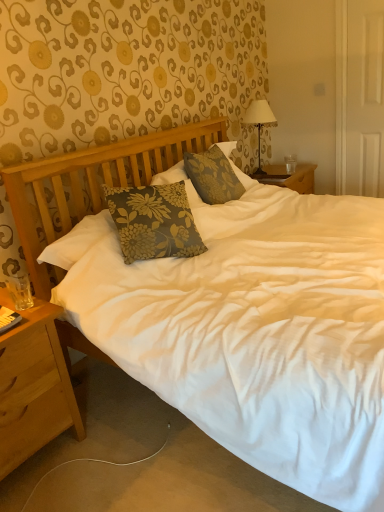
Describe the element at coordinates (34, 388) in the screenshot. This screenshot has height=512, width=384. I see `light brown wood nightstand at lower left` at that location.

Identify the location of light brown wood nightstand at lower left. (34, 388).

This screenshot has height=512, width=384. What do you see at coordinates (259, 124) in the screenshot?
I see `white fabric-covered lamp at upper right` at bounding box center [259, 124].

Find the location of a particular element. This screenshot has width=384, height=512. clear glass coffee cup at right is located at coordinates (290, 163).

Find the location of a particular element. This screenshot has height=512, width=384. floral fabric pillow at center is located at coordinates (171, 175).

Is point (227, 145) less distant than point (292, 156)?

Yes, it is in front of point (292, 156).

From a real-world perspective, relative to clear glass coffee cup at right, is floral fabric pillow at center vertically above or below?

Clearly, from a real-world perspective, floral fabric pillow at center is above clear glass coffee cup at right.

Is floral fabric pillow at center further to camera compared to clear glass coffee cup at right?

No, floral fabric pillow at center is in front of clear glass coffee cup at right.

Does floral fabric pillow at center have a larger size compared to clear glass coffee cup at right?

Indeed, floral fabric pillow at center has a larger size compared to clear glass coffee cup at right.

Locate an element on the screen. This screenshot has height=512, width=384. pillow on the right of light brown wood nightstand at lower left is located at coordinates (171, 175).

From the picture: Based on their sizes in the image, would you say light brown wood nightstand at lower left is bigger or smaller than floral fabric pillow at center?

Considering their sizes, light brown wood nightstand at lower left takes up more space than floral fabric pillow at center.

Can you confirm if light brown wood nightstand at lower left is positioned to the right of floral fabric pillow at center?

No.

Would you say light brown wood nightstand at lower left is a long distance from floral fabric pillow at center?

Yes, light brown wood nightstand at lower left is far from floral fabric pillow at center.

Is white fabric-covered lamp at upper right next to light brown wood nightstand at lower left and touching it?

No, white fabric-covered lamp at upper right is not in contact with light brown wood nightstand at lower left.

How much distance is there between white fabric-covered lamp at upper right and light brown wood nightstand at lower left?

A distance of 6.92 feet exists between white fabric-covered lamp at upper right and light brown wood nightstand at lower left.

Locate an element on the screen. lamp on the right of light brown wood nightstand at lower left is located at coordinates (259, 124).

Consider the image. Does white fabric-covered lamp at upper right have a greater width compared to light brown wood nightstand at lower left?

No.

You are a GUI agent. You are given a task and a screenshot of the screen. Output one action in this format:
    pyautogui.click(x=<x>, y=<y>)
    Task: Click on the coffee cup located on the right of light brown wood nightstand at lower left
    This screenshot has width=384, height=512.
    Given the screenshot: What is the action you would take?
    pos(290,163)

Are light brown wood nightstand at lower left and clear glass coffee cup at right far apart?

Absolutely, light brown wood nightstand at lower left is distant from clear glass coffee cup at right.

Between light brown wood nightstand at lower left and clear glass coffee cup at right, which one appears on the left side from the viewer's perspective?

Positioned to the left is light brown wood nightstand at lower left.

From the image's perspective, which one is positioned higher, clear glass coffee cup at right or white fabric-covered lamp at upper right?

white fabric-covered lamp at upper right appears higher in the image.

Choose the correct answer: Is clear glass coffee cup at right inside white fabric-covered lamp at upper right or outside it?

clear glass coffee cup at right exists outside the volume of white fabric-covered lamp at upper right.

Consider the image. Based on their sizes in the image, would you say clear glass coffee cup at right is bigger or smaller than white fabric-covered lamp at upper right?

Clearly, clear glass coffee cup at right is smaller in size than white fabric-covered lamp at upper right.

Is white fabric-covered lamp at upper right looking in the opposite direction of floral fabric pillow at center?

white fabric-covered lamp at upper right is not turned away from floral fabric pillow at center.

From a real-world perspective, who is located higher, white fabric-covered lamp at upper right or floral fabric pillow at center?

white fabric-covered lamp at upper right is physically above.

Image resolution: width=384 pixels, height=512 pixels. What are the coordinates of `lamp above the floral fabric pillow at center (from the image's perspective)` in the screenshot? It's located at (259, 124).

Is point (275, 124) closer or farther from the camera than point (196, 200)?

Point (275, 124) is positioned farther from the camera compared to point (196, 200).

Looking at the image, does light brown wood nightstand at lower left seem bigger or smaller compared to white fabric-covered lamp at upper right?

Clearly, light brown wood nightstand at lower left is larger in size than white fabric-covered lamp at upper right.

Between light brown wood nightstand at lower left and white fabric-covered lamp at upper right, which one is positioned behind?

white fabric-covered lamp at upper right is behind.

Is point (77, 415) closer or farther from the camera than point (257, 110)?

Point (77, 415).

Can you confirm if light brown wood nightstand at lower left is thinner than white fabric-covered lamp at upper right?

No.

I want to click on pillow above the clear glass coffee cup at right (from a real-world perspective), so click(x=171, y=175).

Find the location of a particular element. The height and width of the screenshot is (512, 384). nightstand on the left side of floral fabric pillow at center is located at coordinates (34, 388).

From the image, which object appears to be farther from clear glass coffee cup at right, floral fabric pillow at center or white fabric-covered lamp at upper right?

Among the two, floral fabric pillow at center is located further to clear glass coffee cup at right.

Looking at the image, which one is located further to clear glass coffee cup at right, light brown wood nightstand at lower left or floral fabric pillow at center?

light brown wood nightstand at lower left is further to clear glass coffee cup at right.

From the image, which object appears to be nearer to clear glass coffee cup at right, light brown wood nightstand at lower left or white fabric-covered lamp at upper right?

white fabric-covered lamp at upper right lies closer to clear glass coffee cup at right than the other object.

Which object lies further to the anchor point light brown wood nightstand at lower left, clear glass coffee cup at right or floral fabric pillow at center?

clear glass coffee cup at right is positioned further to the anchor light brown wood nightstand at lower left.

From the picture: Estimate the real-world distances between objects in this image. Which object is closer to floral fabric pillow at center, clear glass coffee cup at right or white fabric-covered lamp at upper right?

Based on the image, white fabric-covered lamp at upper right appears to be nearer to floral fabric pillow at center.

Considering their positions, is clear glass coffee cup at right positioned further to floral fabric pillow at center than light brown wood nightstand at lower left?

clear glass coffee cup at right is further to floral fabric pillow at center.

When comparing their distances from light brown wood nightstand at lower left, does clear glass coffee cup at right or white fabric-covered lamp at upper right seem closer?

white fabric-covered lamp at upper right is closer to light brown wood nightstand at lower left.

Based on their spatial positions, is white fabric-covered lamp at upper right or clear glass coffee cup at right further from floral fabric pillow at center?

clear glass coffee cup at right.

This screenshot has height=512, width=384. I want to click on lamp between light brown wood nightstand at lower left and clear glass coffee cup at right from front to back, so click(x=259, y=124).

In order to click on pillow between light brown wood nightstand at lower left and clear glass coffee cup at right along the z-axis in this screenshot , I will do `click(171, 175)`.

The width and height of the screenshot is (384, 512). I want to click on lamp positioned between floral fabric pillow at center and clear glass coffee cup at right from near to far, so click(x=259, y=124).

Where is `pillow between light brown wood nightstand at lower left and white fabric-covered lamp at upper right in the front-back direction`? The width and height of the screenshot is (384, 512). pillow between light brown wood nightstand at lower left and white fabric-covered lamp at upper right in the front-back direction is located at coordinates (171, 175).